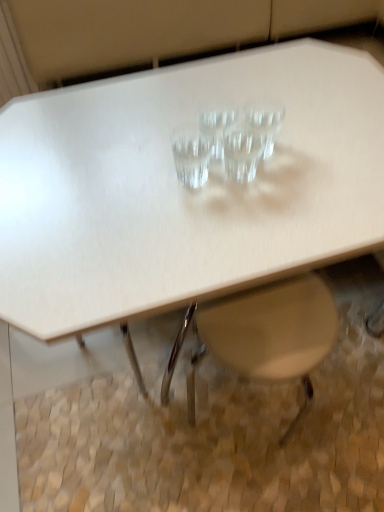
Find the location of a particular element. The image size is (384, 512). unoccupied area in front of transparent glass martini glass at center, acting as the first martini glass starting from the left is located at coordinates (192, 237).